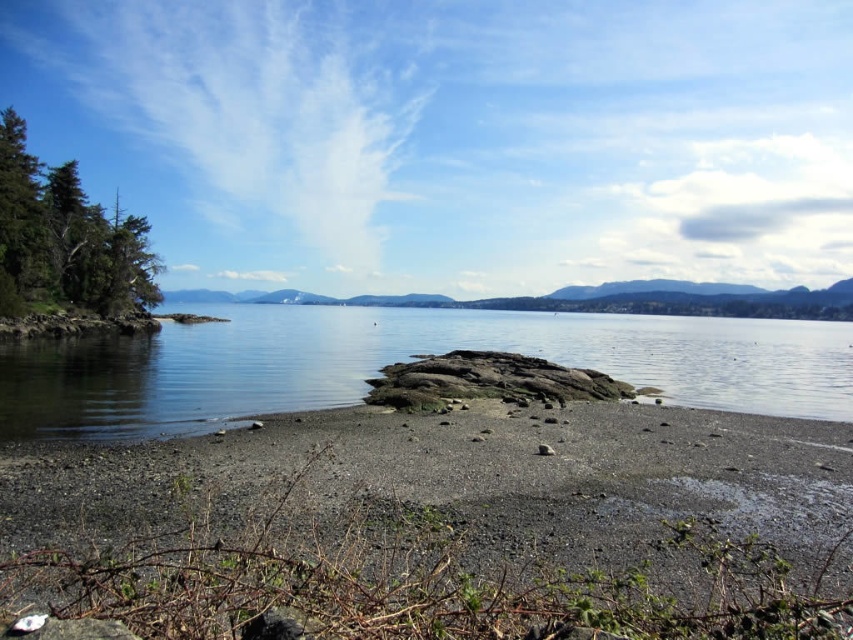
Between clear water at center and green textured tree at left, which one appears on the right side from the viewer's perspective?

Positioned to the right is clear water at center.

Is point (619, 378) in front of point (65, 218)?

Yes, point (619, 378) is in front of point (65, 218).

Find the location of `clear water at center`. clear water at center is located at coordinates (399, 360).

Is smooth pebbles at center thinner than green textured tree at left?

Incorrect, smooth pebbles at center's width is not less than green textured tree at left's.

Between smooth pebbles at center and green textured tree at left, which one has more height?

green textured tree at left

Is point (723, 456) farther from viewer compared to point (129, 232)?

No, (723, 456) is in front of (129, 232).

Where is `smooth pebbles at center`? The image size is (853, 640). smooth pebbles at center is located at coordinates (428, 488).

Does point (735, 499) lie in front of point (305, 312)?

Yes, point (735, 499) is in front of point (305, 312).

Who is more forward, (264, 451) or (32, 380)?

Point (264, 451) is more forward.

The width and height of the screenshot is (853, 640). In order to click on smooth pebbles at center in this screenshot , I will do `click(428, 488)`.